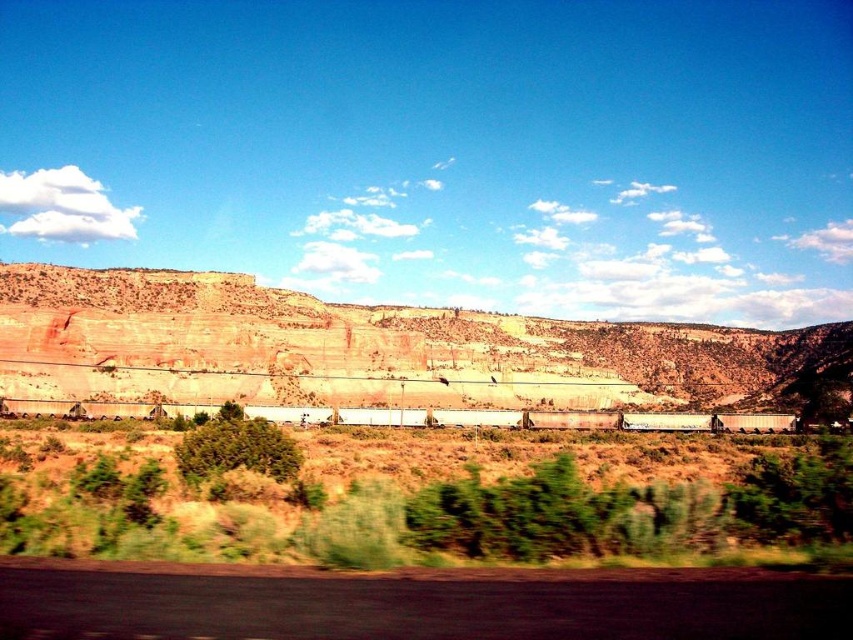
You are a photographer standing on the road and want to take a photo of both the brown grassland at center and the rustic stone cliff at center. Which object will appear larger in your photo?

The brown grassland at center will appear larger in the photo because it is closer to the viewer than the rustic stone cliff at center.